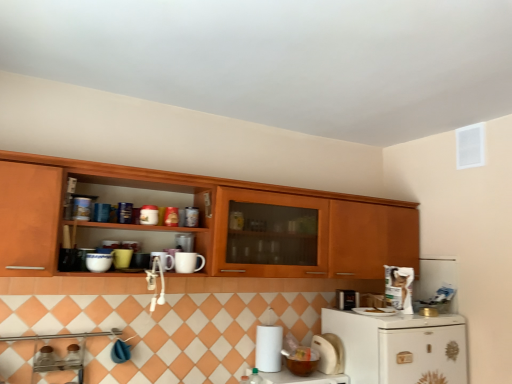
Question: Is white matte paper towel at lower center inside or outside of matte ceramic mug at upper center, positioned as the ninth appliance in right-to-left order?

Choices:
 (A) outside
 (B) inside

Answer: (A)

Question: From the image's perspective, is white matte paper towel at lower center positioned above or below matte ceramic mug at upper center, acting as the 2th appliance starting from the left?

Choices:
 (A) above
 (B) below

Answer: (B)

Question: Which object is positioned farthest from the matte ceramic mug at upper center, acting as the 2th appliance starting from the left?

Choices:
 (A) matte brown bowl at lower center, which appears as the 7th appliance when viewed from the left
 (B) white matte paper towel at lower center
 (C) satin silver toaster at lower right, which is counted as the 9th appliance, starting from the left
 (D) white glossy mug at upper center, which is counted as the 7th appliance, starting from the right
 (E) white matte mug at upper center, arranged as the sixth appliance when viewed from the left

Answer: (C)

Question: Estimate the real-world distances between objects in this image. Which object is farther from the white glossy mug at upper center, the sixth appliance from the right?

Choices:
 (A) white matte mug at upper center, arranged as the sixth appliance when viewed from the left
 (B) white matte paper towel at lower center
 (C) satin silver toaster at lower right, which is counted as the 9th appliance, starting from the left
 (D) white matte paper towel holder at lower right, acting as the 3th appliance starting from the right
 (E) matte brown bowl at lower center, which appears as the 7th appliance when viewed from the left

Answer: (C)